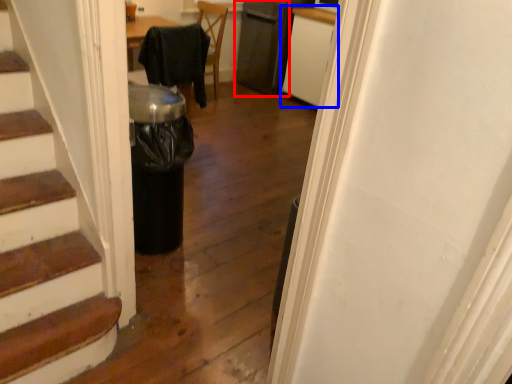
Question: Which object appears farthest to the camera in this image, appliance (highlighted by a red box) or cabinetry (highlighted by a blue box)?

Choices:
 (A) appliance
 (B) cabinetry

Answer: (A)